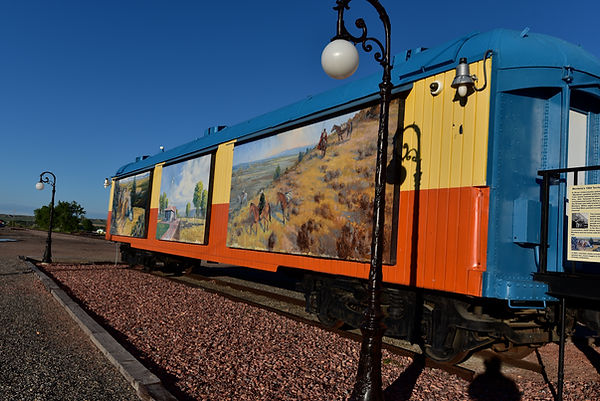
Find the location of `lights`. lights is located at coordinates (329, 52), (41, 183).